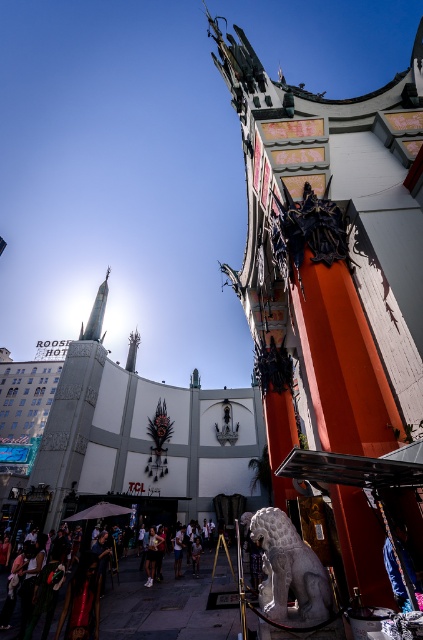
Can you confirm if gray stone lion at lower center is wider than white cotton shirt at center?

Correct, the width of gray stone lion at lower center exceeds that of white cotton shirt at center.

Which of these two, gray stone lion at lower center or white cotton shirt at center, stands shorter?

Standing shorter between the two is white cotton shirt at center.

Between point (288, 621) and point (151, 577), which one is positioned behind?

Point (151, 577)

This screenshot has width=423, height=640. What are the coordinates of `gray stone lion at lower center` in the screenshot? It's located at (288, 577).

Which is in front, point (178, 582) or point (148, 580)?

Point (178, 582) is more forward.

Measure the distance between white stone crowd at lower left and camera.

They are 29.61 meters apart.

Is point (222, 563) less distant than point (151, 531)?

No, (222, 563) is behind (151, 531).

Where is `white stone crowd at lower left`? This screenshot has width=423, height=640. white stone crowd at lower left is located at coordinates (162, 605).

Does white cotton shirt at center appear on the right side of light brown leather jacket at center?

In fact, white cotton shirt at center is to the left of light brown leather jacket at center.

Between white cotton shirt at center and light brown leather jacket at center, which one has less height?

Standing shorter between the two is white cotton shirt at center.

In order to click on white cotton shirt at center in this screenshot , I will do `click(151, 554)`.

At what (x,y) coordinates should I click in order to perform the action: click on white cotton shirt at center. Please return your answer as a coordinate pair (x, y). Looking at the image, I should click on (151, 554).